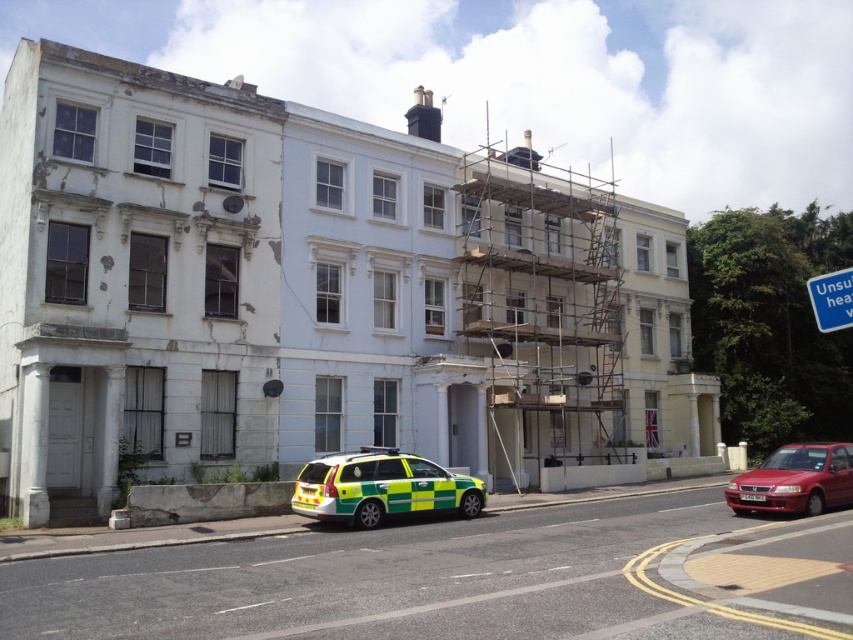
Question: Among these points, which one is farthest from the camera?

Choices:
 (A) (838, 320)
 (B) (480, 497)
 (C) (846, 492)

Answer: (B)

Question: Which of the following is the closest to the observer?

Choices:
 (A) (337, 509)
 (B) (822, 280)
 (C) (751, 492)

Answer: (B)

Question: Which point appears farthest from the camera in this image?

Choices:
 (A) 842,273
 (B) 796,481

Answer: (B)

Question: Does green/yellow striped ambulance at lower center have a larger size compared to blue plastic sign at upper right?

Choices:
 (A) no
 (B) yes

Answer: (A)

Question: Is green/yellow striped ambulance at lower center below blue plastic sign at upper right?

Choices:
 (A) no
 (B) yes

Answer: (B)

Question: Is metallic red sedan at lower right positioned before blue plastic sign at upper right?

Choices:
 (A) yes
 (B) no

Answer: (B)